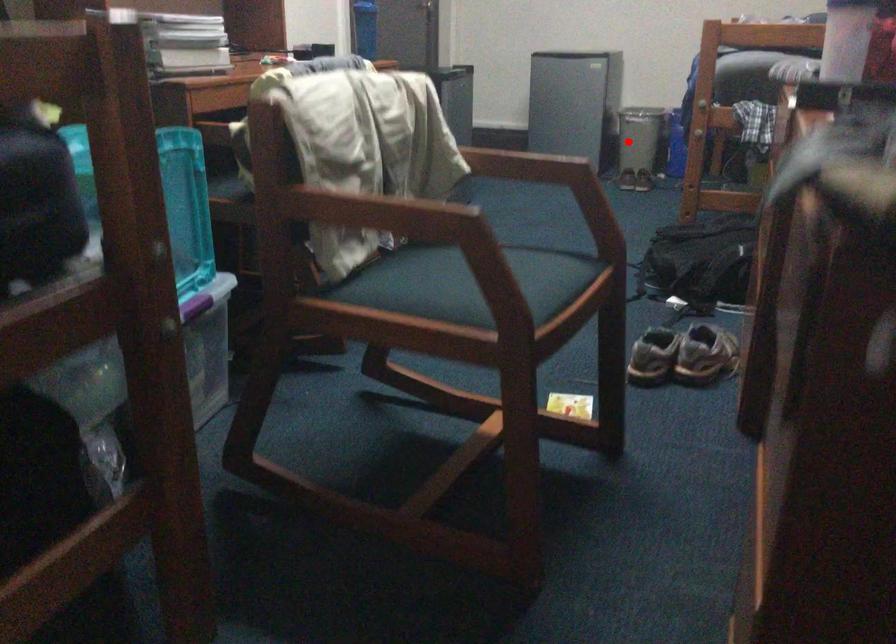
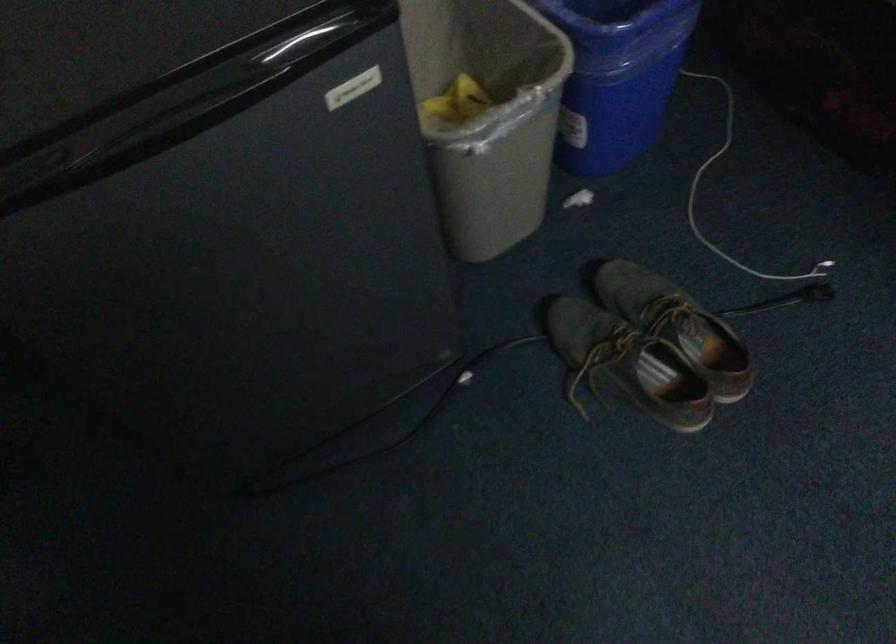
Question: I am providing you with two images of the same scene from different viewpoints. In image1, a red point is highlighted. Considering the same 3D point in image2, which of the following is correct?

Choices:
 (A) It is closer
 (B) It is farther

Answer: (A)